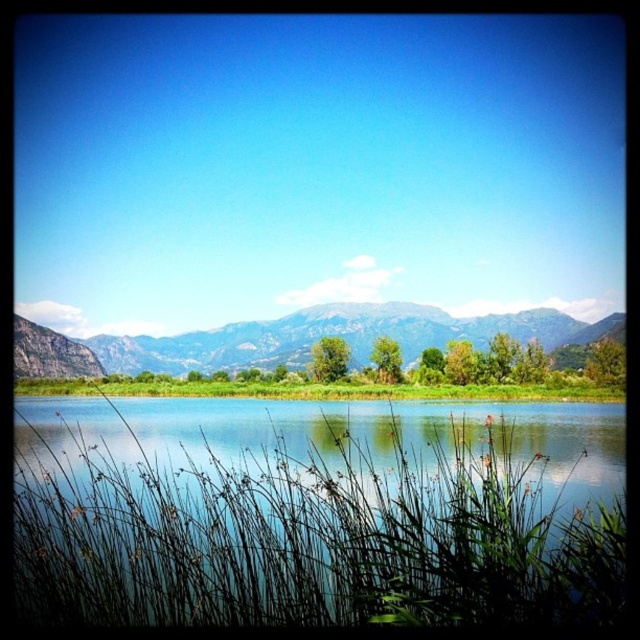
Who is shorter, transparent water at center or rocky gray mountain at center?

With less height is transparent water at center.

How much distance is there between transparent water at center and rocky gray mountain at center?

A distance of 349.29 feet exists between transparent water at center and rocky gray mountain at center.

Is point (268, 532) behind point (120, 364)?

That is False.

In order to click on transparent water at center in this screenshot , I will do click(x=317, y=515).

Can you confirm if transparent water at center is thinner than green grass at center?

Indeed, transparent water at center has a lesser width compared to green grass at center.

Identify the location of transparent water at center. (317, 515).

Which is in front, point (195, 611) or point (292, 381)?

Point (195, 611) is in front.

Identify the location of transparent water at center. (317, 515).

Is rocky gray mountain at center wider than green grass at center?

Yes.

How much distance is there between rocky gray mountain at center and green grass at center?

rocky gray mountain at center and green grass at center are 33.81 meters apart.

This screenshot has width=640, height=640. What are the coordinates of `rocky gray mountain at center` in the screenshot? It's located at (332, 333).